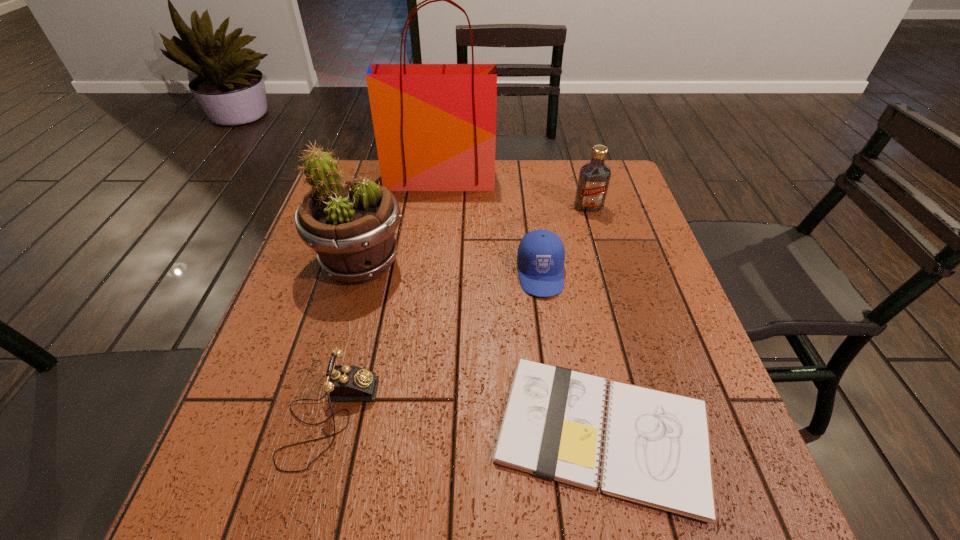
In order to click on unoccupied position between the telephone and the notepad in this screenshot , I will do `click(467, 425)`.

Find the location of `free point between the cap and the telephone`. free point between the cap and the telephone is located at coordinates (435, 345).

Find the location of a particular element. The width and height of the screenshot is (960, 540). free space between the cap and the fourth shortest object is located at coordinates (564, 240).

I want to click on empty space that is in between the telephone and the notepad, so click(x=467, y=425).

Identify the location of free spot between the shopping bag and the notepad. This screenshot has height=540, width=960. (521, 306).

Locate an element on the screen. Image resolution: width=960 pixels, height=540 pixels. unoccupied position between the farthest object and the third tallest object is located at coordinates (515, 193).

Find the location of `empty location between the fifth nearest object and the telephone`. empty location between the fifth nearest object and the telephone is located at coordinates (459, 312).

Identify the location of free space between the farthest object and the vodka. Image resolution: width=960 pixels, height=540 pixels. (515, 193).

Find the location of `free space between the notepad and the cap`. free space between the notepad and the cap is located at coordinates pyautogui.click(x=572, y=353).

Identify the location of free area in between the notepad and the cap. This screenshot has width=960, height=540. click(572, 353).